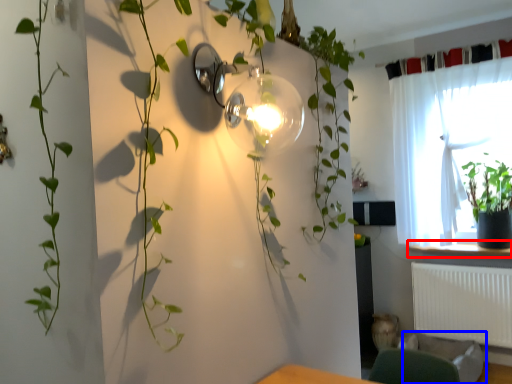
Question: Which of the following is the closest to the observer, window sill (highlighted by a red box) or swivel chair (highlighted by a blue box)?

Choices:
 (A) window sill
 (B) swivel chair

Answer: (B)